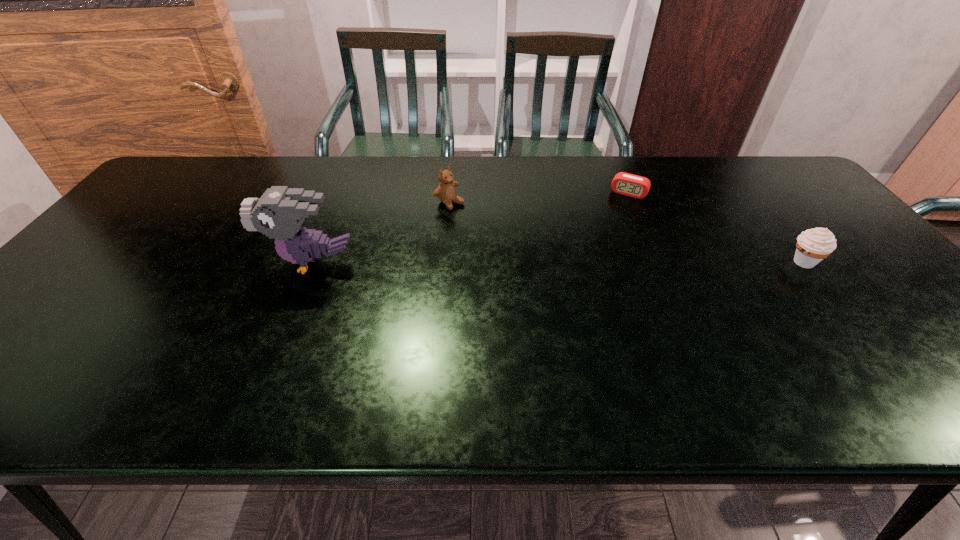
Identify the location of unoccupied area between the teddy bear and the shortest object. (540, 198).

At what (x,y) coordinates should I click in order to perform the action: click on free space that is in between the tallest object and the second object from left to right. Please return your answer as a coordinate pair (x, y). Looking at the image, I should click on (381, 233).

This screenshot has height=540, width=960. I want to click on vacant space that's between the leftmost object and the rightmost object, so click(558, 262).

Where is `unoccupied position between the muffin and the third object from left to right`? unoccupied position between the muffin and the third object from left to right is located at coordinates (716, 227).

The width and height of the screenshot is (960, 540). I want to click on free space between the teddy bear and the tallest object, so click(x=381, y=233).

Identify the location of the closest object relative to the rightmost object. (623, 183).

At what (x,y) coordinates should I click in order to perform the action: click on object that stands as the second closest to the second object from left to right. Please return your answer as a coordinate pair (x, y). This screenshot has width=960, height=540. Looking at the image, I should click on (623, 183).